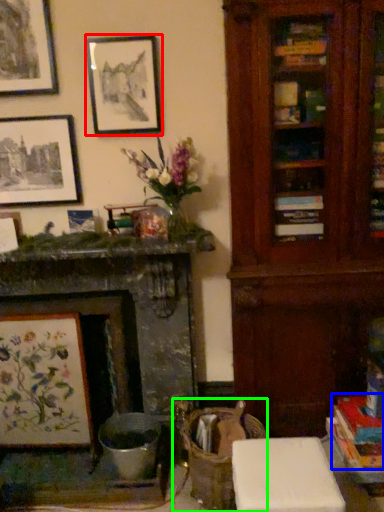
Question: Which object is the farthest from picture frame (highlighted by a red box)? Choose among these: book (highlighted by a blue box) or swivel chair (highlighted by a green box).

Choices:
 (A) book
 (B) swivel chair

Answer: (A)